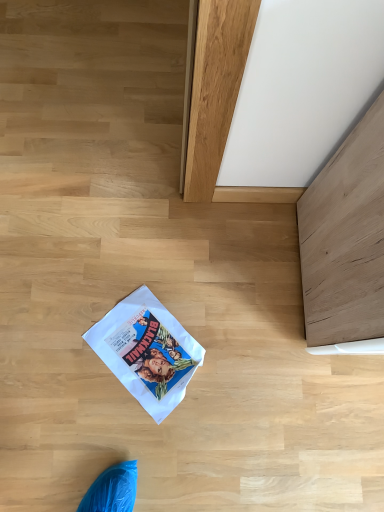
Measure the distance between point (x=172, y=341) and camera.

Point (x=172, y=341) is 3.61 feet from camera.

I want to click on white paper at center, so click(147, 351).

What do you see at coordinates (147, 351) in the screenshot?
I see `white paper at center` at bounding box center [147, 351].

Image resolution: width=384 pixels, height=512 pixels. What are the coordinates of `white paper at center` in the screenshot? It's located at (147, 351).